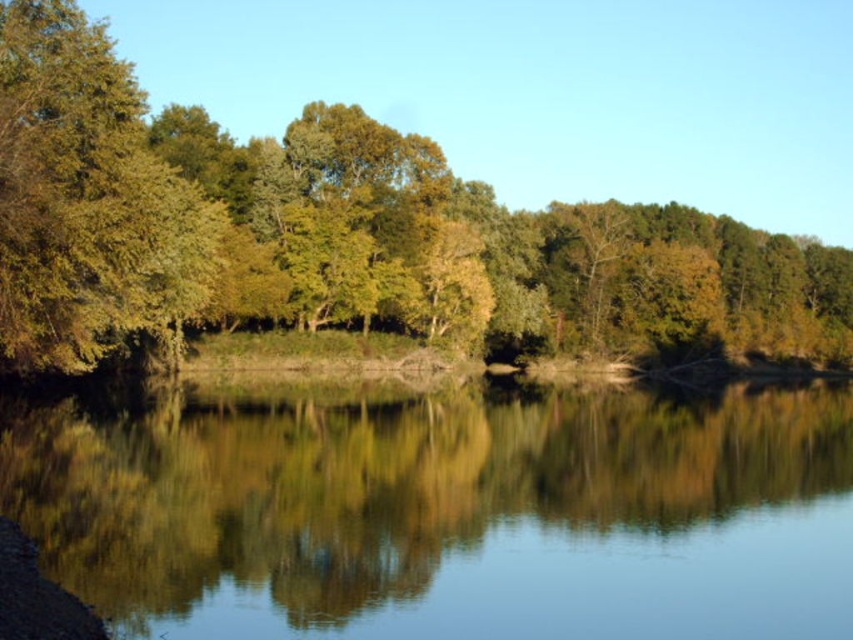
Question: Does clear water at center have a greater width compared to green leafy trees at center?

Choices:
 (A) yes
 (B) no

Answer: (B)

Question: Which object appears closest to the camera in this image?

Choices:
 (A) clear water at center
 (B) green leafy trees at center

Answer: (A)

Question: Can you confirm if clear water at center is positioned to the right of green leafy trees at center?

Choices:
 (A) yes
 (B) no

Answer: (B)

Question: Is clear water at center bigger than green leafy trees at center?

Choices:
 (A) yes
 (B) no

Answer: (B)